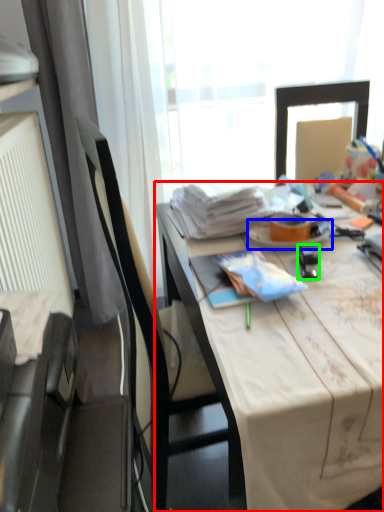
Question: Estimate the real-world distances between objects in this image. Which object is closer to desk (highlighted by a red box), plate (highlighted by a blue box) or stationery (highlighted by a green box)?

Choices:
 (A) plate
 (B) stationery

Answer: (B)